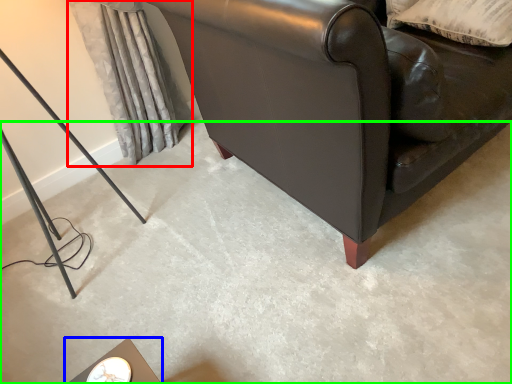
Question: Which is farther away from curtain (highlighted by a red box)? table (highlighted by a blue box) or concrete (highlighted by a green box)?

Choices:
 (A) table
 (B) concrete

Answer: (A)